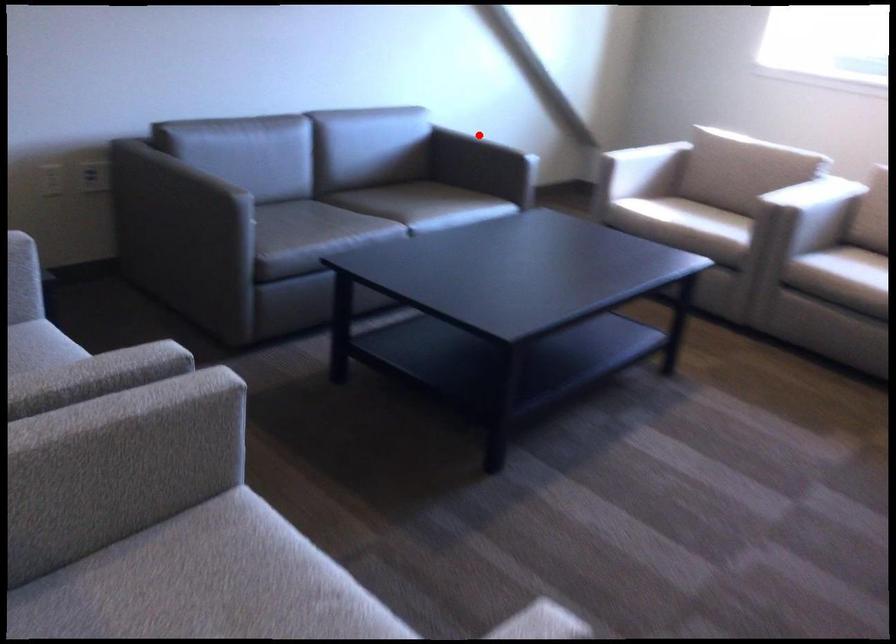
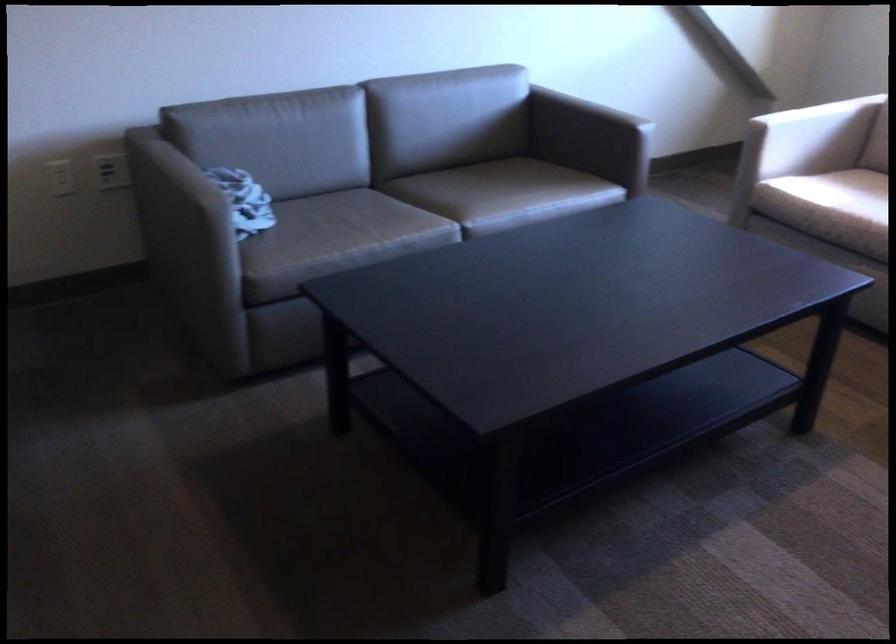
Question: I am providing you with two images of the same scene from different viewpoints. Image1 has a red point marked. In image2, the corresponding 3D location appears at what relative position? Reply with the corresponding letter.

Choices:
 (A) Closer
 (B) Farther

Answer: (A)